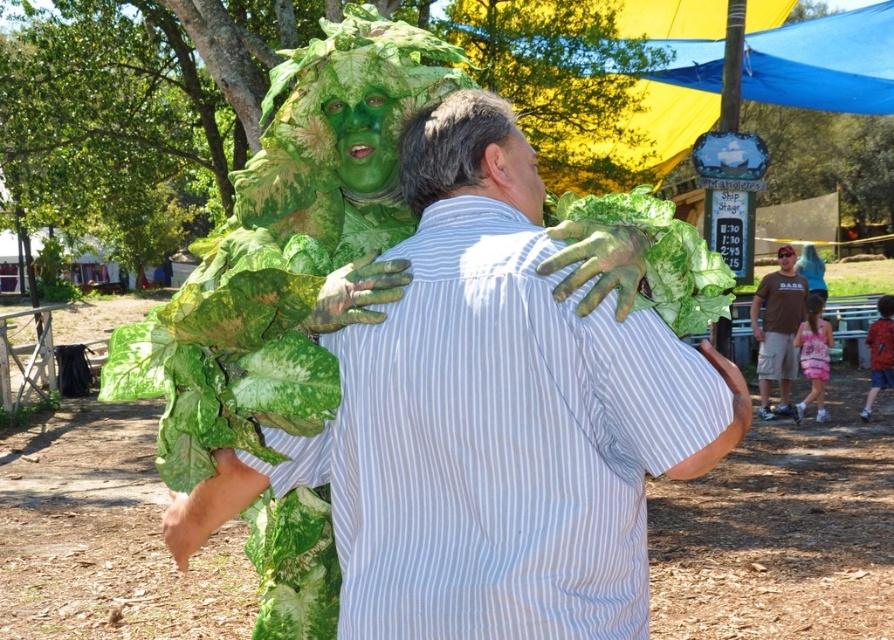
You are a photographer at the event and want to capture both the brown cotton shirt at right and the red plaid shirt at right in the same frame. Which shirt should you focus on to ensure both are visible?

The brown cotton shirt at right is positioned over the red plaid shirt at right, so focusing on the brown cotton shirt at right will ensure both are visible as it is in front.

You are a photographer at the event and want to capture both the green matte leaf at upper center and the brown cotton shirt at right in a single shot. Based on their heights, which object should you focus on first to ensure both are in frame?

The green matte leaf at upper center is not as tall as the brown cotton shirt at right, so focus on the brown cotton shirt at right first to accommodate its greater height.

You are a photographer at the event and want to capture both the matte green costume at center and the pink satin dress at lower right in the same frame. Based on their positions, which one should you focus on first to ensure both are in the shot?

The matte green costume at center is positioned on the left side of pink satin dress at lower right, so you should focus on the pink satin dress at lower right first to ensure both are in the shot.